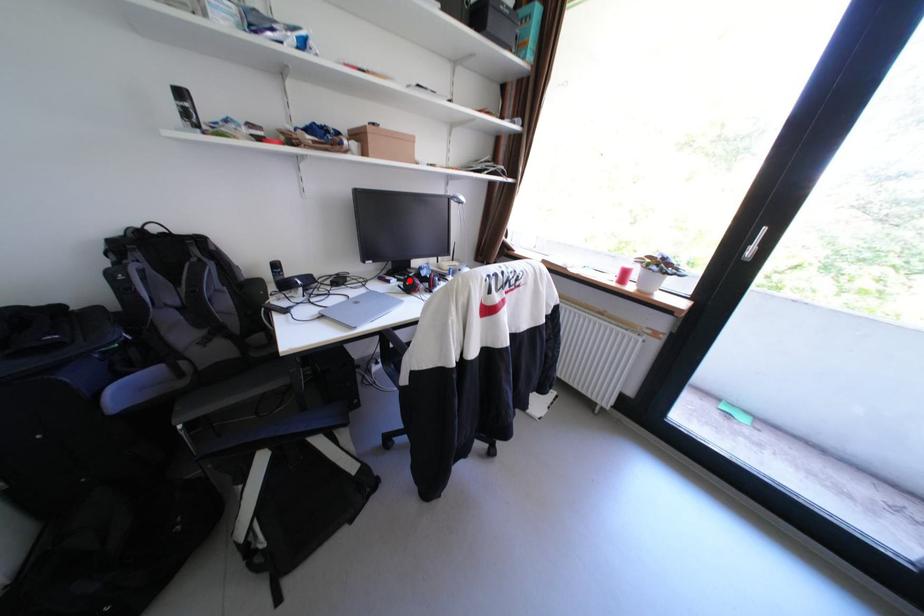
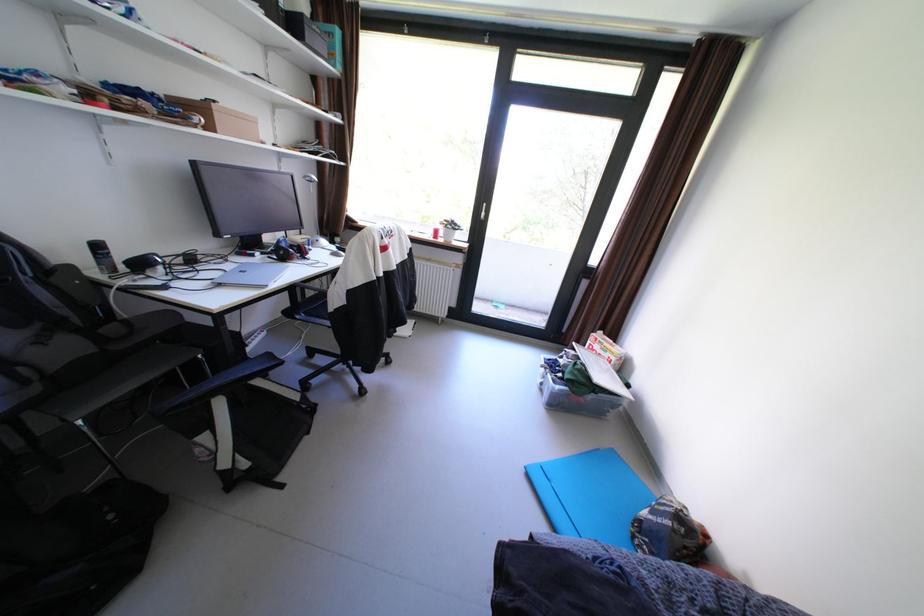
The point at the highlighted location is marked in the first image. Where is the corresponding point in the second image?

(274, 254)